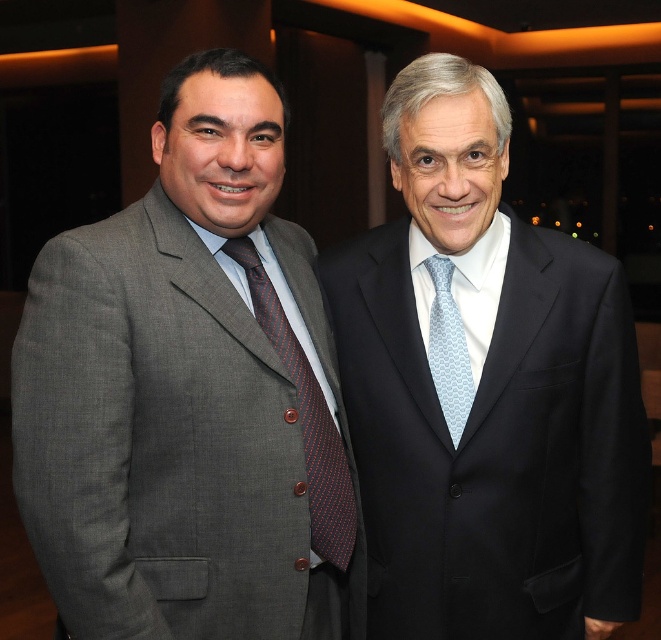
What are the coordinates of `gray textured suit at left` in the screenshot? It's located at pos(188,394).

Does point (350, 497) come closer to viewer compared to point (461, 394)?

No, it is behind (461, 394).

This screenshot has height=640, width=661. I want to click on gray textured suit at left, so click(188, 394).

Can you confirm if matte black suit at right is positioned to the left of light blue textured tie at center?

In fact, matte black suit at right is to the right of light blue textured tie at center.

Who is lower down, matte black suit at right or light blue textured tie at center?

Positioned lower is matte black suit at right.

Who is more distant from viewer, (334, 324) or (447, 426)?

The point (334, 324) is more distant.

The height and width of the screenshot is (640, 661). I want to click on matte black suit at right, so click(x=485, y=390).

Can you confirm if red dotted tie at center is shorter than light blue textured tie at center?

No.

Can you confirm if red dotted tie at center is positioned above light blue textured tie at center?

Actually, red dotted tie at center is below light blue textured tie at center.

This screenshot has height=640, width=661. Describe the element at coordinates (305, 419) in the screenshot. I see `red dotted tie at center` at that location.

Locate an element on the screen. Image resolution: width=661 pixels, height=640 pixels. red dotted tie at center is located at coordinates (305, 419).